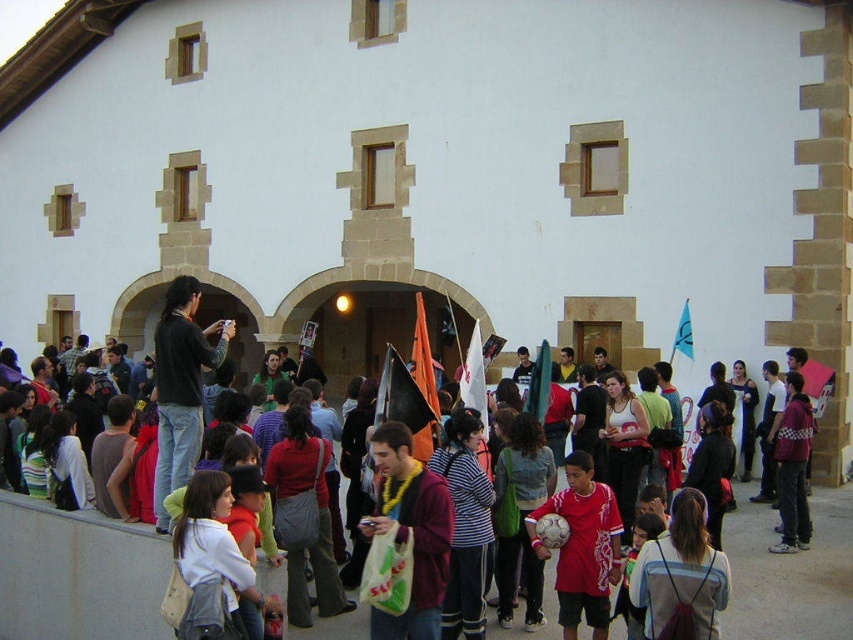
Which is below, dark gray sweater at center or orange fabric flag at center?

orange fabric flag at center is lower down.

Does dark gray sweater at center come behind orange fabric flag at center?

No, it is not.

At what (x,y) coordinates should I click in order to perform the action: click on dark gray sweater at center. Please return your answer as a coordinate pair (x, y). The width and height of the screenshot is (853, 640). Looking at the image, I should click on (181, 387).

Between dark gray sweater at center and blue fabric flag at center-right, which one is positioned higher?

blue fabric flag at center-right is above.

Who is taller, dark gray sweater at center or blue fabric flag at center-right?

dark gray sweater at center is taller.

Is point (213, 362) closer to camera compared to point (688, 301)?

Yes, it is.

Image resolution: width=853 pixels, height=640 pixels. Find the location of `dark gray sweater at center`. dark gray sweater at center is located at coordinates (181, 387).

Looking at this image, is red shirt at center shorter than dark gray sweater at center?

Correct, red shirt at center is not as tall as dark gray sweater at center.

Describe the element at coordinates (77, 573) in the screenshot. The height and width of the screenshot is (640, 853). I see `red shirt at center` at that location.

At what (x,y) coordinates should I click in order to perform the action: click on red shirt at center. Please return your answer as a coordinate pair (x, y). The height and width of the screenshot is (640, 853). Looking at the image, I should click on (77, 573).